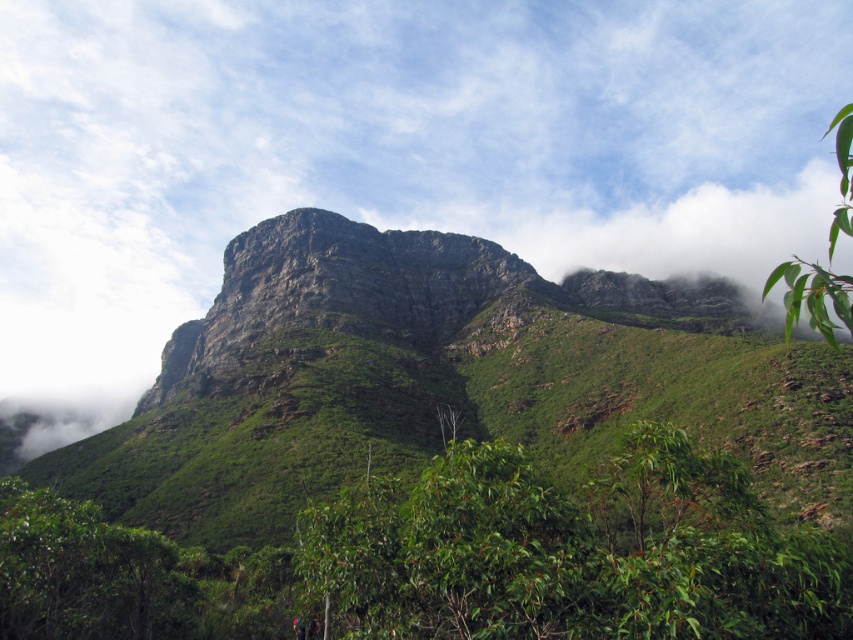
Question: Considering the real-world distances, which object is farthest from the green leafy shrubs at center?

Choices:
 (A) white fluffy cloud at upper center
 (B) green rocky mountain at center
 (C) green leafy branch at upper right

Answer: (A)

Question: Does white fluffy cloud at upper center have a lesser width compared to green rocky mountain at center?

Choices:
 (A) no
 (B) yes

Answer: (A)

Question: Is green rocky mountain at center to the right of green leafy branch at upper right from the viewer's perspective?

Choices:
 (A) no
 (B) yes

Answer: (A)

Question: Is green rocky mountain at center thinner than green leafy branch at upper right?

Choices:
 (A) no
 (B) yes

Answer: (B)

Question: Which object is the closest to the green leafy branch at upper right?

Choices:
 (A) white fluffy cloud at upper center
 (B) green leafy shrubs at center

Answer: (B)

Question: Among these objects, which one is nearest to the camera?

Choices:
 (A) white fluffy cloud at upper center
 (B) green leafy branch at upper right

Answer: (B)